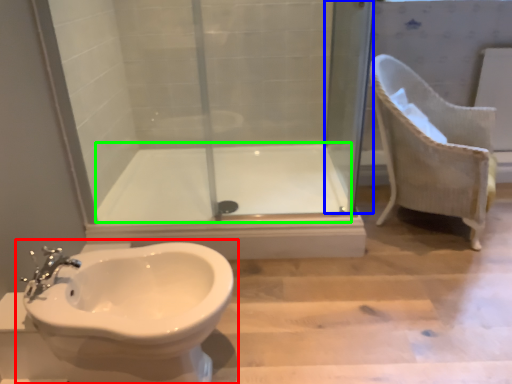
Question: Which object is positioned closest to toilet (highlighted by a red box)? Select from screen door (highlighted by a blue box) and bath (highlighted by a green box).

Choices:
 (A) screen door
 (B) bath

Answer: (B)